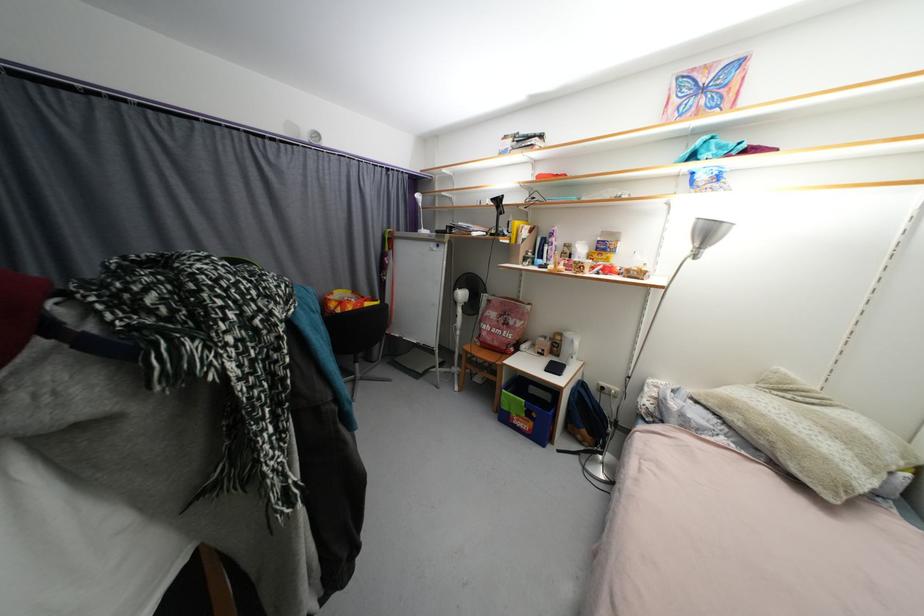
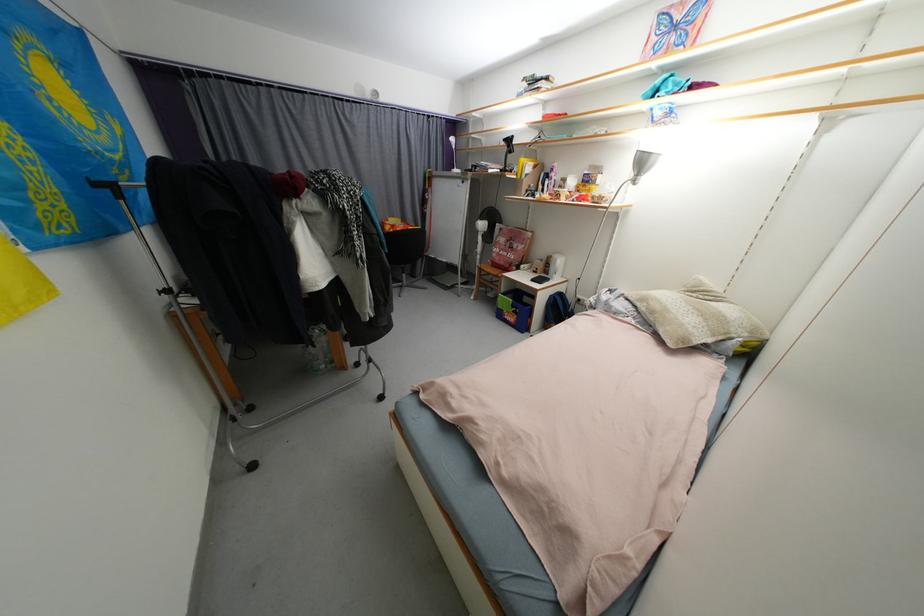
Where in the second image is the point corresponding to [764,434] from the first image?

(658, 314)